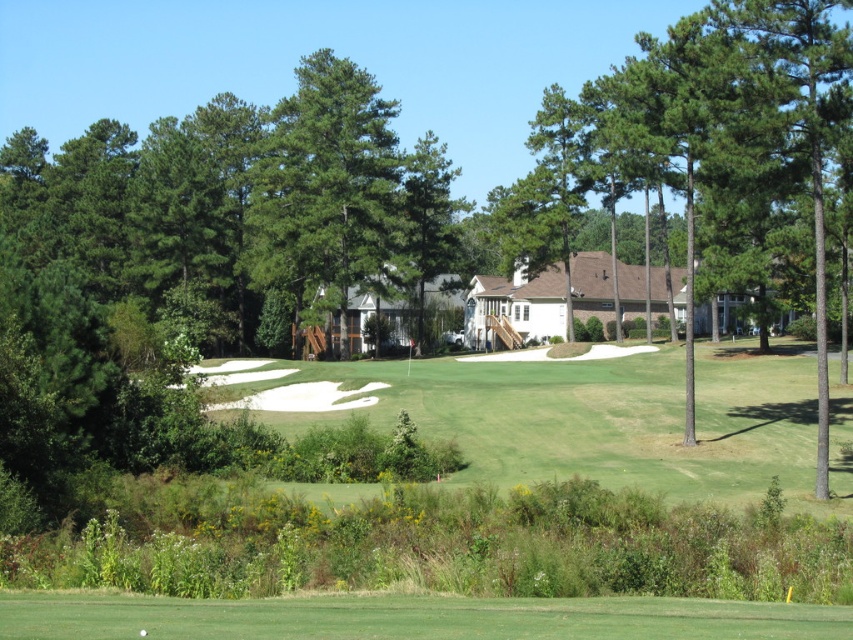
Between green grassy fairway at center and green grass at lower center, which one is positioned lower?

green grass at lower center is below.

Is point (434, 397) positioned behind point (676, 624)?

Yes.

The height and width of the screenshot is (640, 853). I want to click on green grassy fairway at center, so click(584, 416).

Is green grassy fairway at center to the left of green leafy tree at center from the viewer's perspective?

No, green grassy fairway at center is not to the left of green leafy tree at center.

At what (x,y) coordinates should I click in order to perform the action: click on green grassy fairway at center. Please return your answer as a coordinate pair (x, y). Looking at the image, I should click on (584, 416).

The width and height of the screenshot is (853, 640). Find the location of `green grassy fairway at center`. green grassy fairway at center is located at coordinates (584, 416).

Can you confirm if green grass at lower center is positioned above green leafy tree at center?

No.

Is green grass at lower center shorter than green leafy tree at center?

Yes, green grass at lower center is shorter than green leafy tree at center.

Is point (802, 625) closer to camera compared to point (305, 116)?

Yes, point (802, 625) is in front of point (305, 116).

Identify the location of green grass at lower center. The height and width of the screenshot is (640, 853). (409, 616).